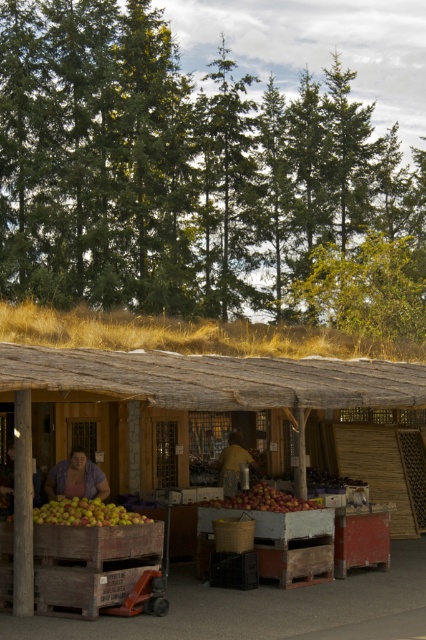
You are a customer standing at the entrance of the rustic outdoor market stall. You see the green matte pine at upper center and the yellowish matte apples at lower left. How far apart are these two items from each other?

The green matte pine at upper center and the yellowish matte apples at lower left are 35.09 meters apart from each other.

You are standing in front of the rustic outdoor market stall and want to determine which of the two points, point (40, 368) or point (8, 467), is closer to you. Based on the scene description, which point is nearer?

Point (40, 368) is closer to the viewer than point (8, 467).